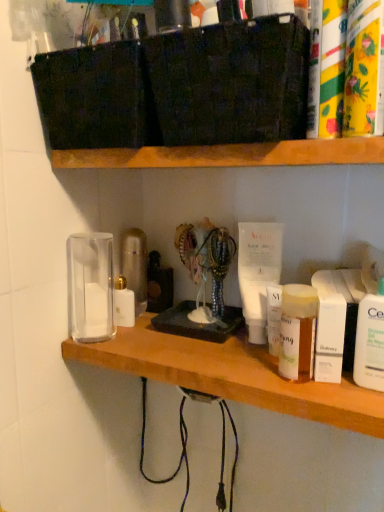
Question: Is white plastic lotion at right, placed as the 4th toiletry when sorted from back to front, far from wooden shelf at upper center, positioned as the first shelf in top-to-bottom order?

Choices:
 (A) yes
 (B) no

Answer: (B)

Question: Can you confirm if white plastic lotion at right, which ranks as the first toiletry in right-to-left order, is positioned to the left of wooden shelf at upper center, positioned as the first shelf in top-to-bottom order?

Choices:
 (A) yes
 (B) no

Answer: (B)

Question: From a real-world perspective, is white plastic lotion at right, which ranks as the first toiletry in right-to-left order, on top of wooden shelf at upper center, the second shelf ordered from the bottom?

Choices:
 (A) no
 (B) yes

Answer: (A)

Question: Considering the relative sizes of white plastic lotion at right, placed as the 4th toiletry when sorted from back to front, and wooden shelf at upper center, the second shelf ordered from the bottom, in the image provided, is white plastic lotion at right, placed as the 4th toiletry when sorted from back to front, taller than wooden shelf at upper center, the second shelf ordered from the bottom,?

Choices:
 (A) no
 (B) yes

Answer: (B)

Question: From the image's perspective, is white plastic lotion at right, the third toiletry viewed from the front, over wooden shelf at upper center, the second shelf ordered from the bottom?

Choices:
 (A) no
 (B) yes

Answer: (A)

Question: Visually, is clear glass jar at center, the first shelf in the bottom-to-top sequence, positioned to the left or to the right of white glossy lotion at left, the 1th toiletry in the left-to-right sequence?

Choices:
 (A) left
 (B) right

Answer: (B)

Question: From a real-world perspective, is clear glass jar at center, acting as the 2th shelf starting from the top, physically located above or below white glossy lotion at left, the 1th toiletry in the left-to-right sequence?

Choices:
 (A) above
 (B) below

Answer: (B)

Question: Considering the positions of point (319, 406) and point (125, 232), is point (319, 406) closer or farther from the camera than point (125, 232)?

Choices:
 (A) closer
 (B) farther

Answer: (A)

Question: Considering the positions of clear glass jar at center, the first shelf in the bottom-to-top sequence, and white glossy lotion at left, the 6th toiletry when ordered from right to left, in the image, is clear glass jar at center, the first shelf in the bottom-to-top sequence, wider or thinner than white glossy lotion at left, the 6th toiletry when ordered from right to left,?

Choices:
 (A) wide
 (B) thin

Answer: (A)

Question: Looking at the image, does translucent plastic jar at center right, the 2th toiletry when ordered from left to right, seem bigger or smaller compared to wooden shelf at upper center, positioned as the first shelf in top-to-bottom order?

Choices:
 (A) big
 (B) small

Answer: (B)

Question: In the image, is translucent plastic jar at center right, the second toiletry from the back, on the left side or the right side of wooden shelf at upper center, the second shelf ordered from the bottom?

Choices:
 (A) right
 (B) left

Answer: (A)

Question: Is translucent plastic jar at center right, the 2th toiletry when ordered from left to right, wider or thinner than wooden shelf at upper center, the second shelf ordered from the bottom?

Choices:
 (A) thin
 (B) wide

Answer: (A)

Question: Considering their positions, is translucent plastic jar at center right, the 5th toiletry positioned from the front, located in front of or behind wooden shelf at upper center, positioned as the first shelf in top-to-bottom order?

Choices:
 (A) front
 (B) behind

Answer: (B)

Question: Which is correct: yellow paper towel roll at upper right, which appears as the fourth toiletry when viewed from the right, is inside wooden shelf at upper center, positioned as the first shelf in top-to-bottom order, or outside of it?

Choices:
 (A) outside
 (B) inside

Answer: (A)

Question: Considering the positions of yellow paper towel roll at upper right, which appears as the fourth toiletry when viewed from the right, and wooden shelf at upper center, positioned as the first shelf in top-to-bottom order, in the image, is yellow paper towel roll at upper right, which appears as the fourth toiletry when viewed from the right, taller or shorter than wooden shelf at upper center, positioned as the first shelf in top-to-bottom order,?

Choices:
 (A) tall
 (B) short

Answer: (A)